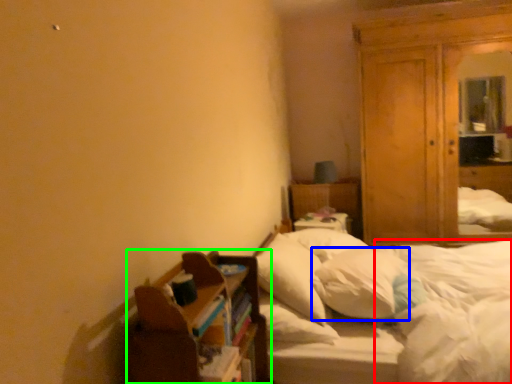
Question: Considering the real-world distances, which object is farthest from mattress (highlighted by a red box)? pillow (highlighted by a blue box) or shelf (highlighted by a green box)?

Choices:
 (A) pillow
 (B) shelf

Answer: (B)